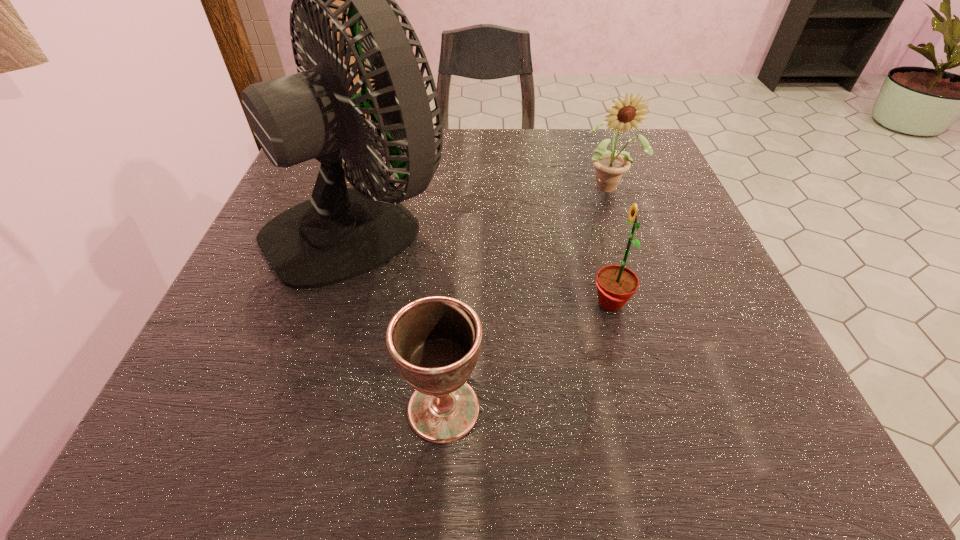
Find the location of `free space located on the left of the shortest object`. free space located on the left of the shortest object is located at coordinates (210, 409).

Locate an element on the screen. This screenshot has width=960, height=540. fan situated at the far edge is located at coordinates (340, 233).

You are a GUI agent. You are given a task and a screenshot of the screen. Output one action in this format:
    pyautogui.click(x=<x>, y=<y>)
    Task: Click on the sunflower that is at the far edge
    This screenshot has height=540, width=960.
    Given the screenshot: What is the action you would take?
    pyautogui.click(x=609, y=166)

Find the location of a particular element. This screenshot has width=960, height=540. object that is positioned at the near edge is located at coordinates [435, 341].

Locate an element on the screen. object present at the left edge is located at coordinates (340, 233).

Find the location of a particular element. The width and height of the screenshot is (960, 540). object present at the right edge is located at coordinates (609, 166).

The image size is (960, 540). In order to click on object situated at the far left corner in this screenshot , I will do click(x=340, y=233).

This screenshot has height=540, width=960. I want to click on object situated at the far right corner, so click(609, 166).

At what (x,y) coordinates should I click in order to perform the action: click on free space at the far edge of the desktop. Please return your answer as a coordinate pair (x, y). This screenshot has height=540, width=960. Looking at the image, I should click on (508, 183).

Image resolution: width=960 pixels, height=540 pixels. What are the coordinates of `vacant region at the left edge` in the screenshot? It's located at (275, 281).